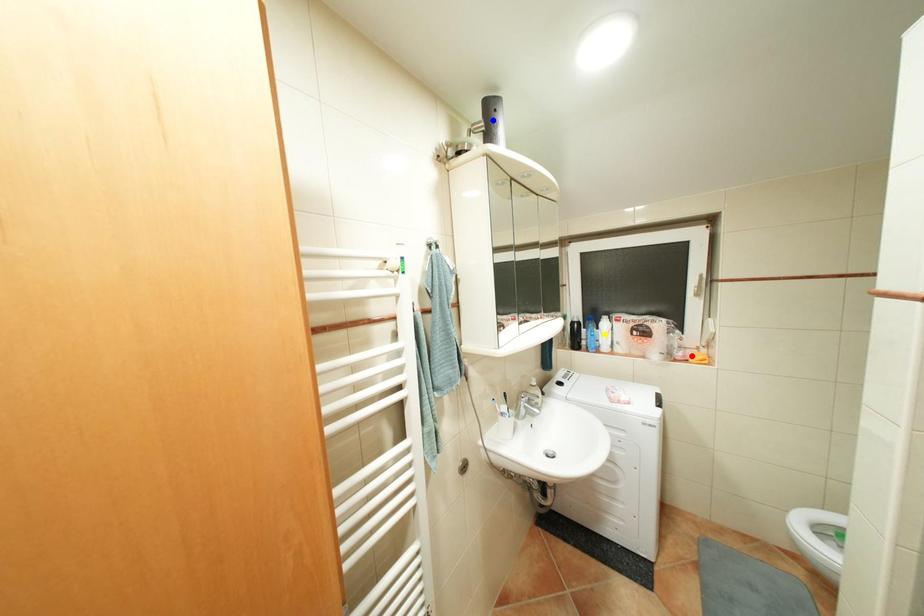
Order these from nearest to farthest:
1. yellow point
2. red point
3. blue point

blue point < red point < yellow point